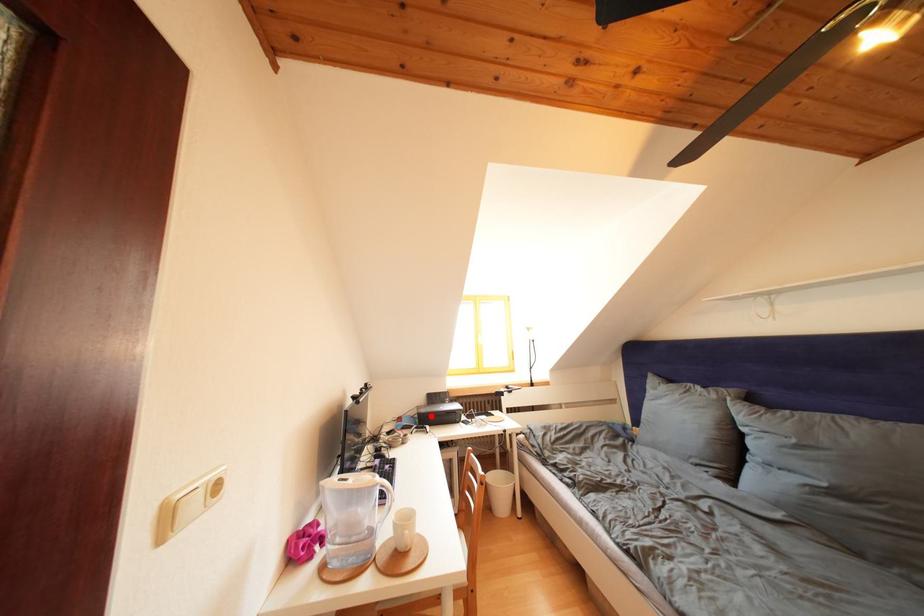
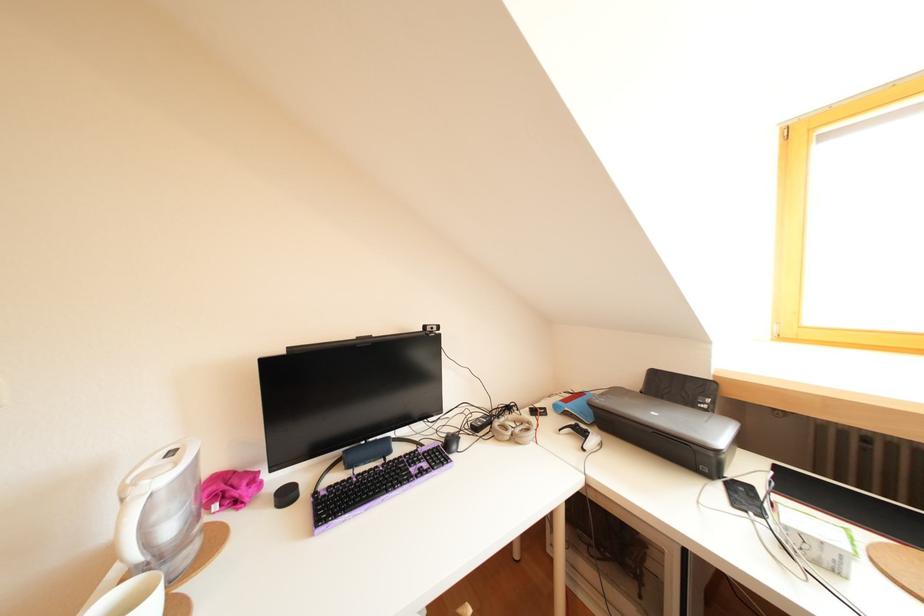
The point at the highlighted location is marked in the first image. Where is the corresponding point in the second image?

(610, 407)